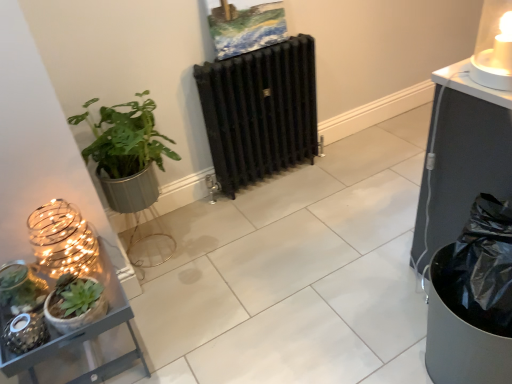
Where is `vacant space to the right of metallic gray shelf at lower left`? vacant space to the right of metallic gray shelf at lower left is located at coordinates (190, 328).